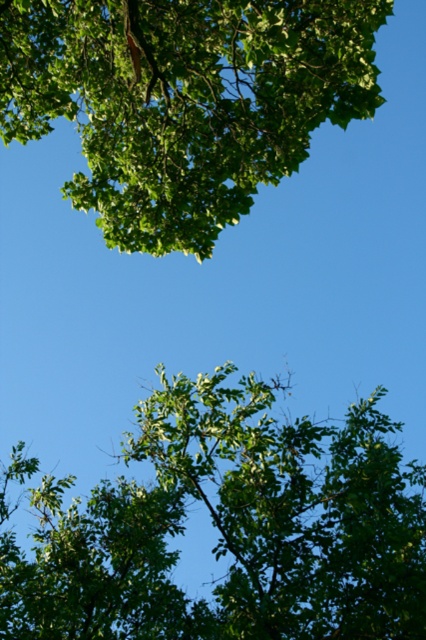
Who is taller, green leafy tree at upper center or green leafy tree at upper left?

green leafy tree at upper left is taller.

Where is `green leafy tree at upper center`? green leafy tree at upper center is located at coordinates (230, 529).